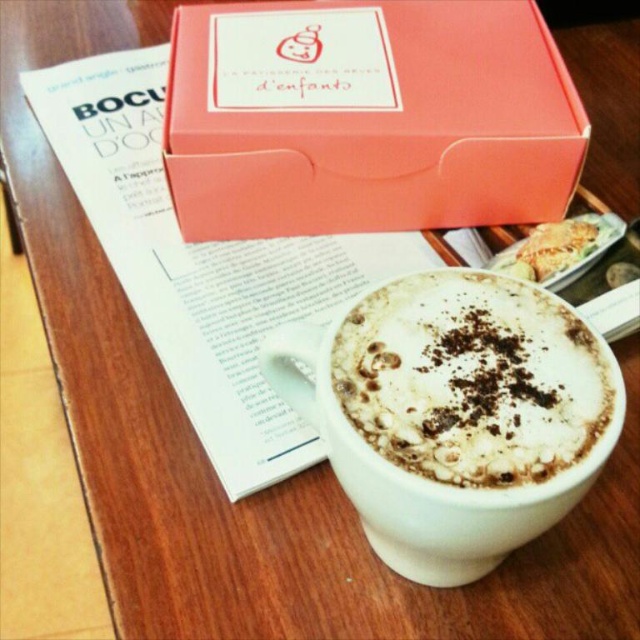
Which is more to the right, white frothy coffee at center or golden crispy pastry at upper right?

From the viewer's perspective, golden crispy pastry at upper right appears more on the right side.

I want to click on white frothy coffee at center, so click(472, 378).

Is point (442, 429) behind point (577, 230)?

That is False.

The height and width of the screenshot is (640, 640). Identify the location of white frothy coffee at center. (472, 378).

Is point (358, 104) positioned after point (440, 460)?

That is True.

Does pink cardboard box at upper center appear over white frothy coffee at center?

Indeed, pink cardboard box at upper center is positioned over white frothy coffee at center.

Is point (509, 177) farther from camera compared to point (369, 433)?

That is True.

Identify the location of pink cardboard box at upper center. (368, 116).

Is pink cardboard box at upper center wider than golden crispy pastry at upper right?

Yes.

Which is behind, point (227, 208) or point (611, 227)?

The point (227, 208) is more distant.

The width and height of the screenshot is (640, 640). I want to click on pink cardboard box at upper center, so click(x=368, y=116).